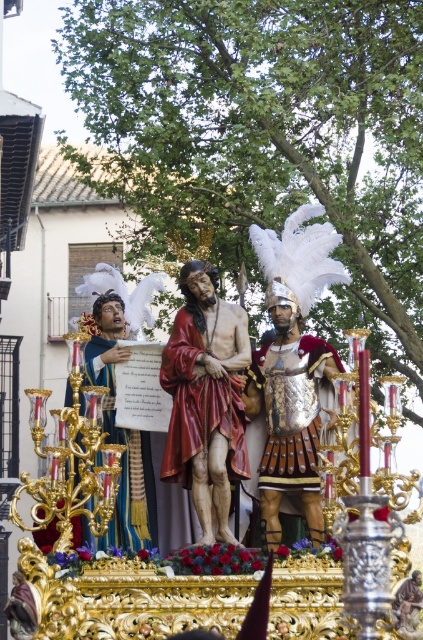
You are a photographer trying to capture the religious procession. You want to ensure that the polished gold statue at center and the smooth red robe at center are both visible in your shot. Based on their positions, which object should you focus on first to ensure both are in frame?

The polished gold statue at center is below the smooth red robe at center, so you should focus on the smooth red robe at center first to ensure both are in frame.

You are an architect designing a new museum exhibit. The exhibit will feature a large glass display case that must accommodate the polished gold statue at center. The case must be placed such that the statue is centered within it. Given that the statue is marked by the point at coordinates (261, 362), what coordinates should the center of the glass display case be positioned at to ensure proper alignment?

The center of the glass display case should be positioned at the coordinates (261, 362) to align with the polished gold statue at center.